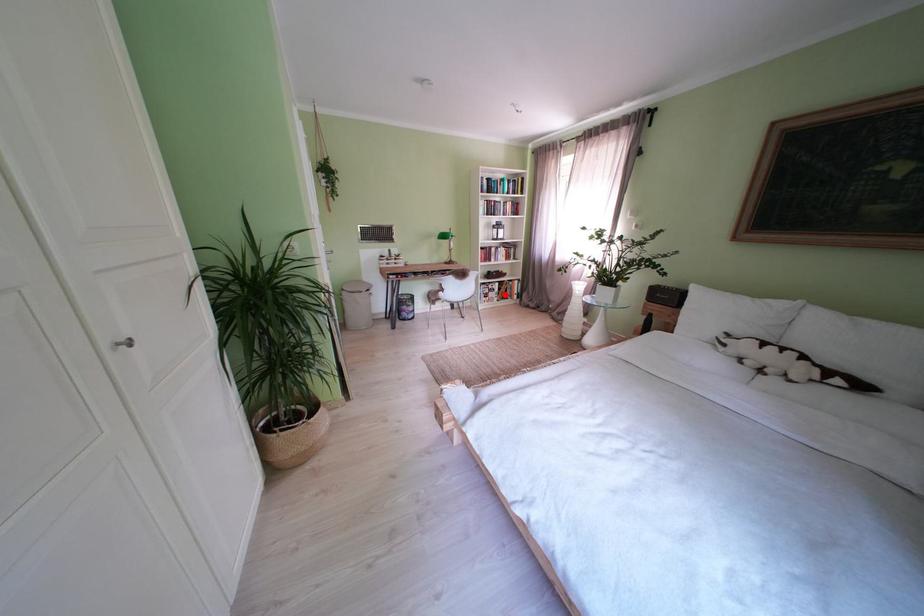
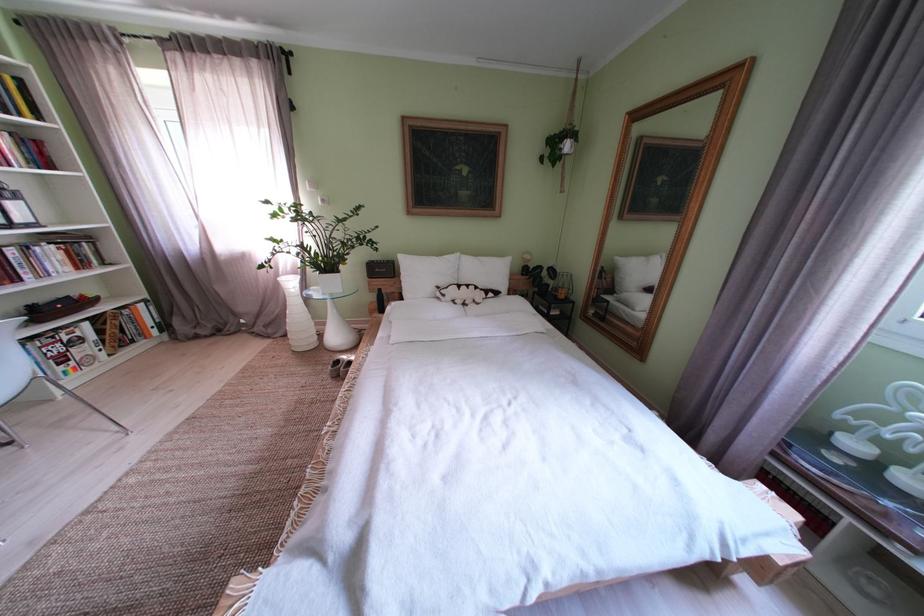
Question: I am providing you with two images of the same scene from different viewpoints. Given a red point in image1, look at the same physical point in image2. Is it:

Choices:
 (A) Closer to the viewpoint
 (B) Farther from the viewpoint

Answer: (B)